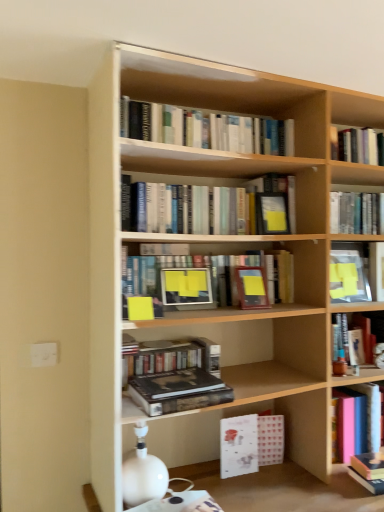
Question: Is hardcover book at upper right, arranged as the 8th book when ordered from the bottom, to the left or to the right of pink matte book at right, the 1th book when ordered from bottom to top, in the image?

Choices:
 (A) right
 (B) left

Answer: (A)

Question: Is hardcover book at upper right, arranged as the 8th book when ordered from the bottom, bigger or smaller than pink matte book at right, the 8th book in the top-to-bottom sequence?

Choices:
 (A) big
 (B) small

Answer: (A)

Question: Estimate the real-world distances between objects in this image. Which object is farther from the matte black paperback book at upper center, acting as the 2th paperback book starting from the front?

Choices:
 (A) hardcover books at center, which is counted as the seventh book, starting from the top
 (B) light wood bookcase at center
 (C) pink matte book at right, the 1th book when ordered from bottom to top
 (D) hardcover book at right, the sixth book in the top-to-bottom sequence
 (E) hardcover book at upper right, the 1th book viewed from the top

Answer: (C)

Question: Estimate the real-world distances between objects in this image. Which object is closer to the matte black paperback book at upper center, acting as the 2th paperback book starting from the front?

Choices:
 (A) hardcover book at center, which is counted as the 1th paperback book, starting from the front
 (B) hardcover books at center, which is counted as the seventh book, starting from the top
 (C) light wood bookcase at center
 (D) hardcover books at upper center, the 3th book viewed from the top
 (E) matte wooden frame at center, the 5th book in the top-to-bottom sequence

Answer: (D)